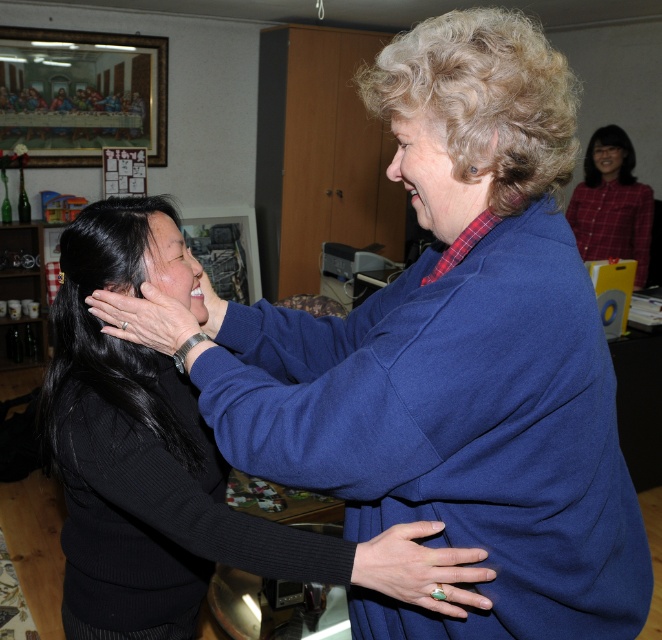
Which of these two, black sweater at center or plaid fabric shirt at upper right, stands taller?

With more height is plaid fabric shirt at upper right.

Which of these two, black sweater at center or plaid fabric shirt at upper right, stands shorter?

black sweater at center is shorter.

Is point (105, 509) positioned after point (624, 244)?

That is False.

Find the location of a particular element. black sweater at center is located at coordinates (171, 461).

Consider the image. Between plaid fabric shirt at upper right and green gemstone ring at center, which one is positioned higher?

plaid fabric shirt at upper right

Describe the element at coordinates (610, 204) in the screenshot. The image size is (662, 640). I see `plaid fabric shirt at upper right` at that location.

Locate an element on the screen. plaid fabric shirt at upper right is located at coordinates (610, 204).

Between black sweater at center and matte skin hand at center, which one has more height?

black sweater at center

Which is above, black sweater at center or matte skin hand at center?

matte skin hand at center is higher up.

The width and height of the screenshot is (662, 640). Identify the location of black sweater at center. (x=171, y=461).